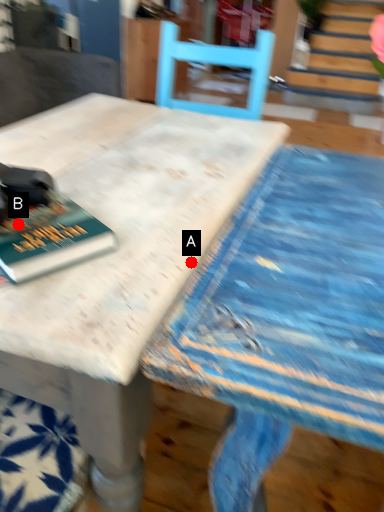
Question: Two points are circled on the image, labeled by A and B beside each circle. Which point is farther to the camera?

Choices:
 (A) A is further
 (B) B is further

Answer: (A)